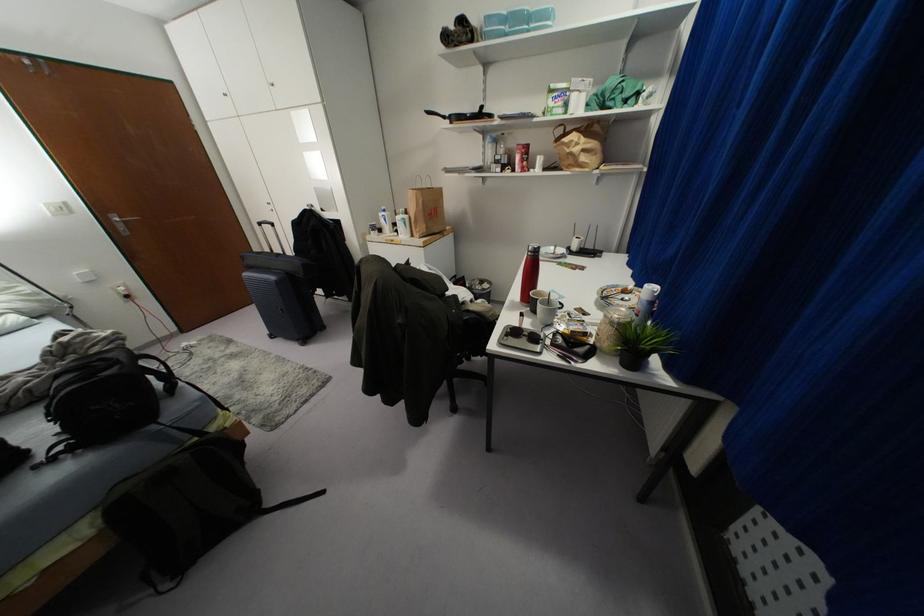
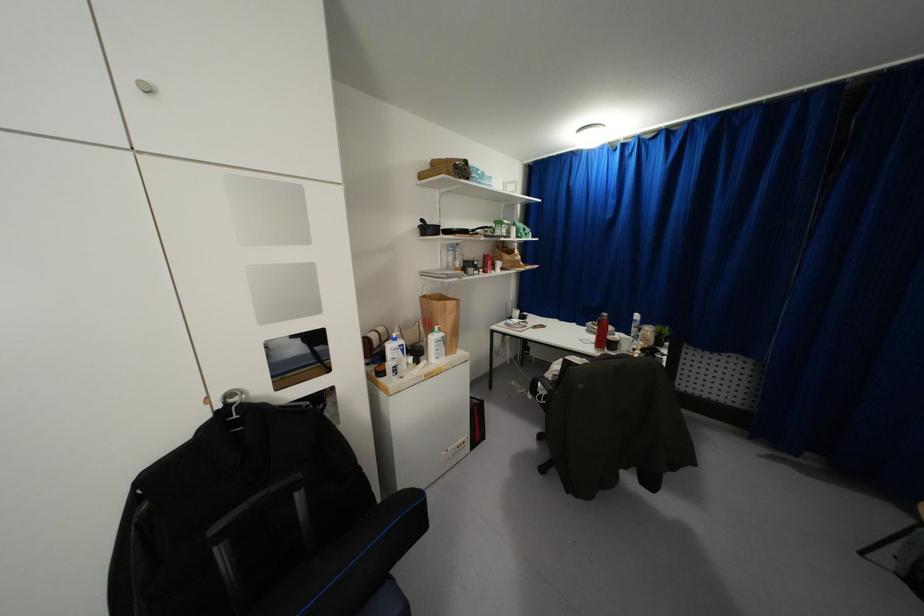
Locate, in the second image, the point that corresponds to the point at 405,216 in the first image.

(442, 333)